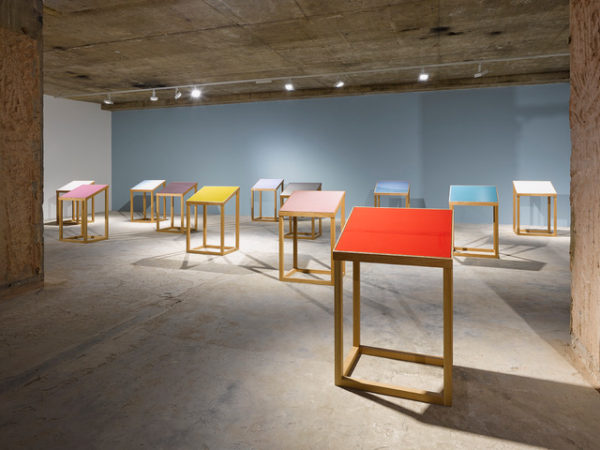
You are a GUI agent. You are given a task and a screenshot of the screen. Output one action in this format:
    pyautogui.click(x=<x>, y=<y>)
    Task: Click on the lights
    Image resolution: width=600 pixels, height=450 pixels.
    Given the screenshot: What is the action you would take?
    pyautogui.click(x=196, y=95), pyautogui.click(x=290, y=86), pyautogui.click(x=338, y=84)